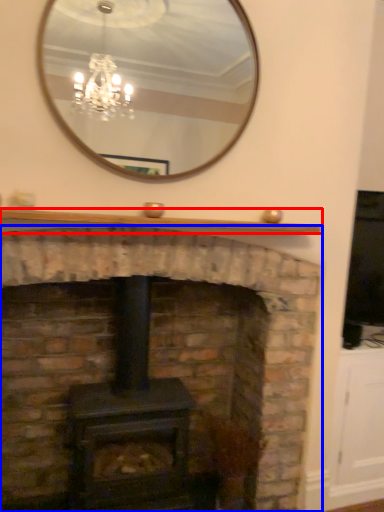
Question: Among these objects, which one is farthest to the camera, mantle (highlighted by a red box) or fireplace (highlighted by a blue box)?

Choices:
 (A) mantle
 (B) fireplace

Answer: (A)